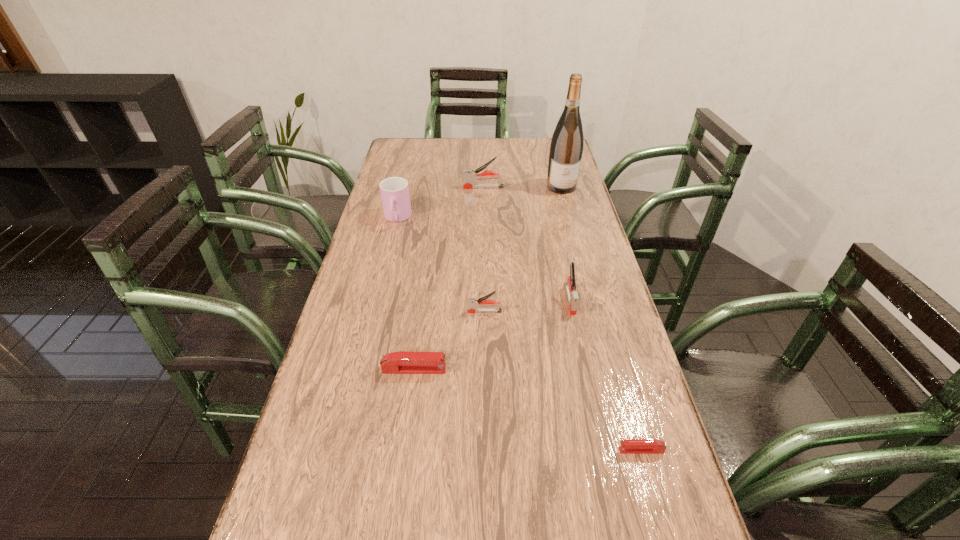
The image size is (960, 540). Find the location of `vacant space that satisfies the following two spatial constraints: 1. on the handle side of the farthest stapler; 2. with the handle on the side of the leftmost object`. vacant space that satisfies the following two spatial constraints: 1. on the handle side of the farthest stapler; 2. with the handle on the side of the leftmost object is located at coordinates (484, 219).

Locate an element on the screen. The width and height of the screenshot is (960, 540). vacant space that satisfies the following two spatial constraints: 1. on the handle side of the second smallest gray stapler; 2. on the handle side of the third shortest object is located at coordinates (572, 312).

Identify the location of vacant area in the image that satisfies the following two spatial constraints: 1. on the label of the tallest object; 2. on the front-facing side of the second nearest object. (610, 369).

Image resolution: width=960 pixels, height=540 pixels. In order to click on vacant area in the image that satisfies the following two spatial constraints: 1. on the handle side of the farthest gray stapler; 2. with the handle on the side of the cup in this screenshot , I will do `click(484, 219)`.